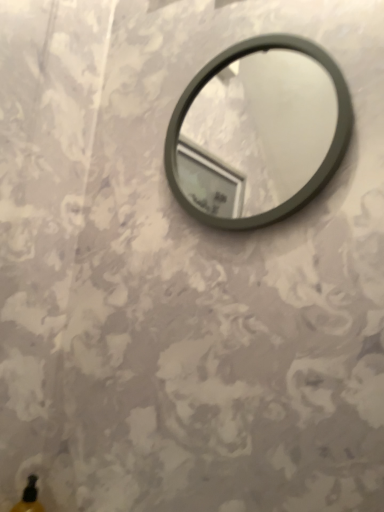
Question: Can you confirm if translucent yellow bottle at lower left is smaller than matte gray mirror at center?

Choices:
 (A) no
 (B) yes

Answer: (B)

Question: Could matte gray mirror at center be considered to be inside translucent yellow bottle at lower left?

Choices:
 (A) yes
 (B) no

Answer: (B)

Question: Is translucent yellow bottle at lower left to the right of matte gray mirror at center from the viewer's perspective?

Choices:
 (A) yes
 (B) no

Answer: (B)

Question: Is translucent yellow bottle at lower left oriented towards matte gray mirror at center?

Choices:
 (A) yes
 (B) no

Answer: (B)

Question: Considering the relative sizes of translucent yellow bottle at lower left and matte gray mirror at center in the image provided, is translucent yellow bottle at lower left taller than matte gray mirror at center?

Choices:
 (A) no
 (B) yes

Answer: (A)

Question: Is translucent yellow bottle at lower left bigger than matte gray mirror at center?

Choices:
 (A) yes
 (B) no

Answer: (B)

Question: Is matte gray mirror at center next to translucent yellow bottle at lower left?

Choices:
 (A) yes
 (B) no

Answer: (B)

Question: From a real-world perspective, does matte gray mirror at center sit lower than translucent yellow bottle at lower left?

Choices:
 (A) yes
 (B) no

Answer: (B)

Question: Can you confirm if matte gray mirror at center is smaller than translucent yellow bottle at lower left?

Choices:
 (A) yes
 (B) no

Answer: (B)

Question: Is matte gray mirror at center to the right of translucent yellow bottle at lower left from the viewer's perspective?

Choices:
 (A) yes
 (B) no

Answer: (A)

Question: Does matte gray mirror at center have a larger size compared to translucent yellow bottle at lower left?

Choices:
 (A) yes
 (B) no

Answer: (A)

Question: From the image's perspective, would you say matte gray mirror at center is positioned over translucent yellow bottle at lower left?

Choices:
 (A) no
 (B) yes

Answer: (B)

Question: From their relative heights in the image, would you say matte gray mirror at center is taller or shorter than translucent yellow bottle at lower left?

Choices:
 (A) tall
 (B) short

Answer: (A)